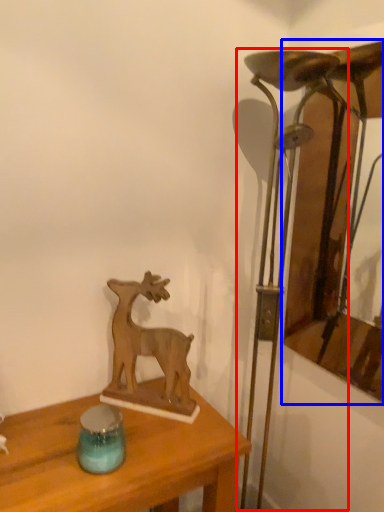
Question: Which object appears farthest to the camera in this image, table lamp (highlighted by a red box) or picture frame (highlighted by a blue box)?

Choices:
 (A) table lamp
 (B) picture frame

Answer: (B)